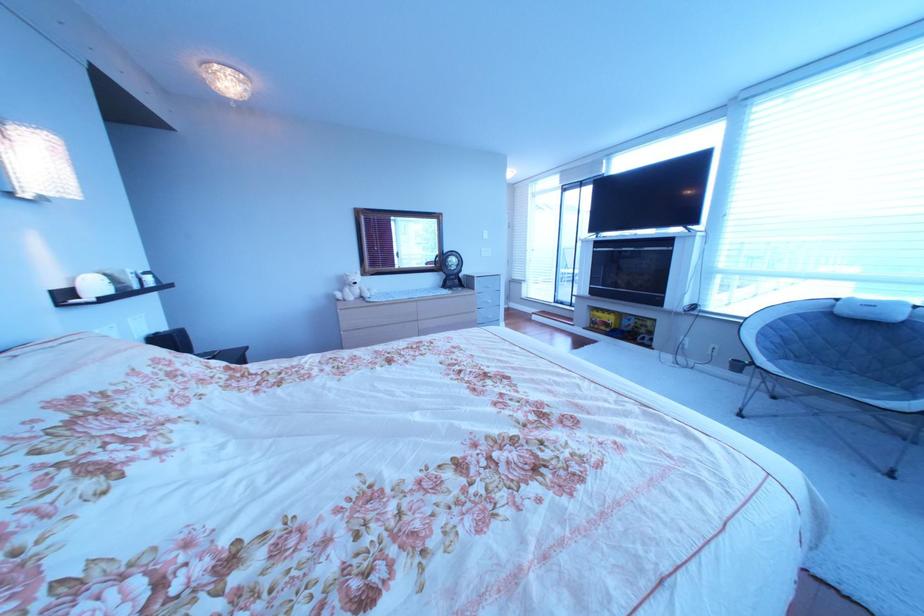
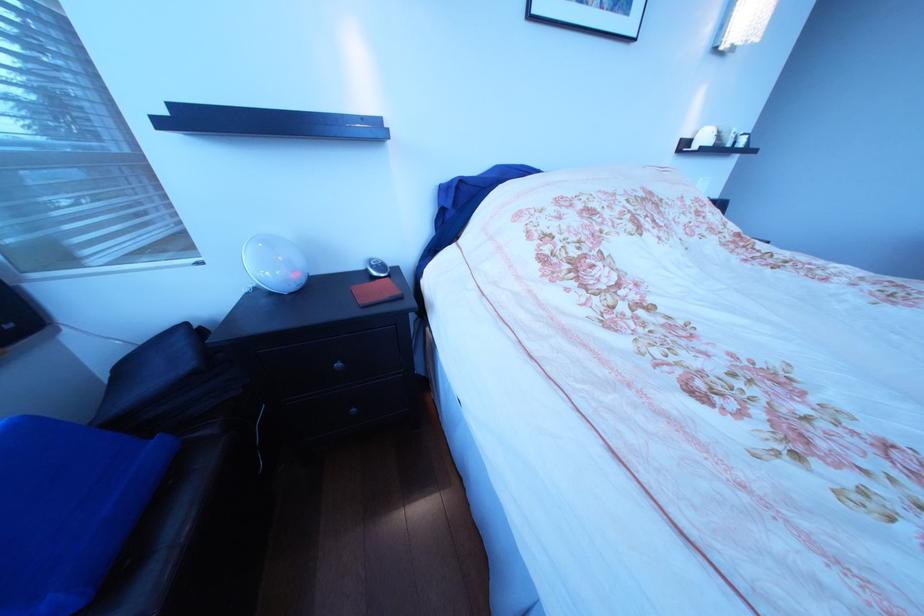
Find the pixel in the second image that matches (123,292) in the first image.

(724, 146)